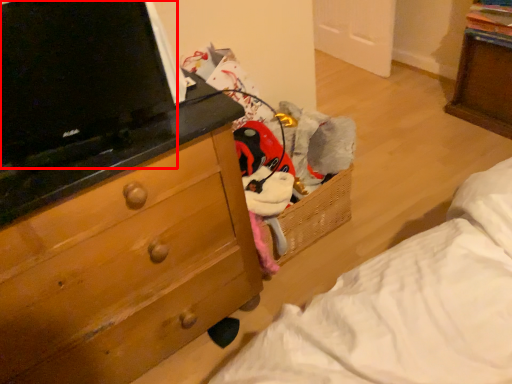
Question: In this image, where is computer (annotated by the red box) located relative to chest of drawers?

Choices:
 (A) left
 (B) right

Answer: (B)